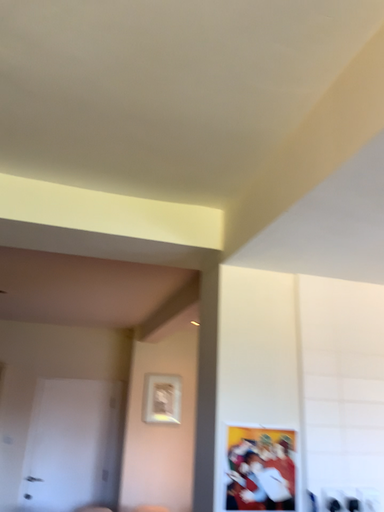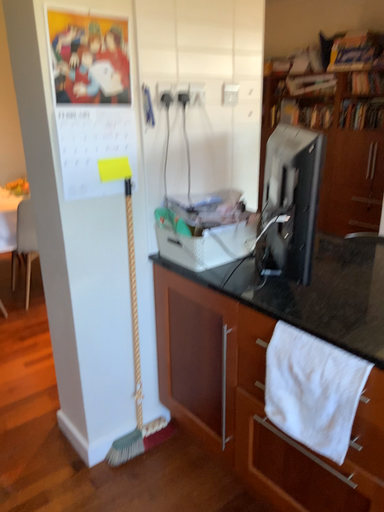
Question: Which way did the camera rotate in the video?

Choices:
 (A) rotated left
 (B) rotated right

Answer: (B)